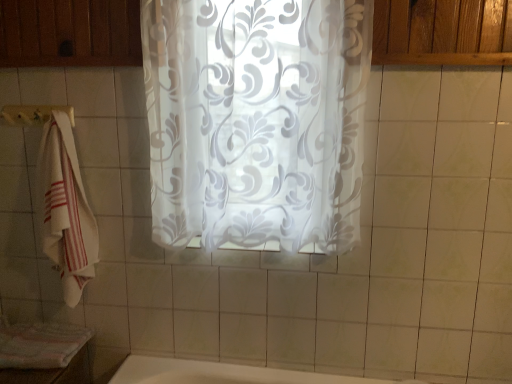
Question: From the image's perspective, would you say striped cotton bath towel at lower left is shown under white cotton towel at left?

Choices:
 (A) yes
 (B) no

Answer: (A)

Question: Can you confirm if striped cotton bath towel at lower left is wider than white cotton towel at left?

Choices:
 (A) yes
 (B) no

Answer: (A)

Question: Does striped cotton bath towel at lower left appear on the right side of white cotton towel at left?

Choices:
 (A) no
 (B) yes

Answer: (A)

Question: Is white cotton towel at left inside striped cotton bath towel at lower left?

Choices:
 (A) no
 (B) yes

Answer: (A)

Question: Is striped cotton bath towel at lower left outside of white cotton towel at left?

Choices:
 (A) yes
 (B) no

Answer: (A)

Question: Considering their positions, is striped cotton bath towel at lower left located in front of or behind white fabric towel bar at left?

Choices:
 (A) front
 (B) behind

Answer: (A)

Question: From their relative heights in the image, would you say striped cotton bath towel at lower left is taller or shorter than white fabric towel bar at left?

Choices:
 (A) tall
 (B) short

Answer: (B)

Question: Considering the positions of point (19, 327) and point (22, 109), is point (19, 327) closer or farther from the camera than point (22, 109)?

Choices:
 (A) farther
 (B) closer

Answer: (A)

Question: From a real-world perspective, is striped cotton bath towel at lower left physically located above or below white fabric towel bar at left?

Choices:
 (A) below
 (B) above

Answer: (A)

Question: Is white fabric towel bar at left to the left or to the right of white cotton towel at left in the image?

Choices:
 (A) left
 (B) right

Answer: (A)

Question: From a real-world perspective, is white fabric towel bar at left physically located above or below white cotton towel at left?

Choices:
 (A) below
 (B) above

Answer: (B)

Question: Is white fabric towel bar at left taller or shorter than white cotton towel at left?

Choices:
 (A) tall
 (B) short

Answer: (B)

Question: Looking at the image, does white fabric towel bar at left seem bigger or smaller compared to white cotton towel at left?

Choices:
 (A) big
 (B) small

Answer: (B)

Question: Considering their positions, is transparent floral-patterned curtain at center located in front of or behind white cotton towel at left?

Choices:
 (A) behind
 (B) front

Answer: (B)

Question: Is point (167, 77) closer or farther from the camera than point (95, 258)?

Choices:
 (A) farther
 (B) closer

Answer: (B)